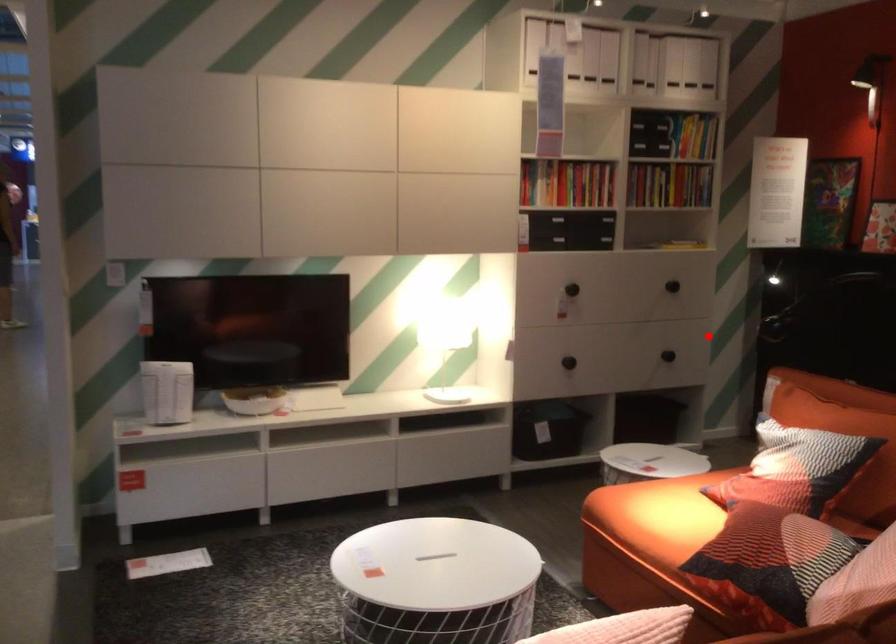
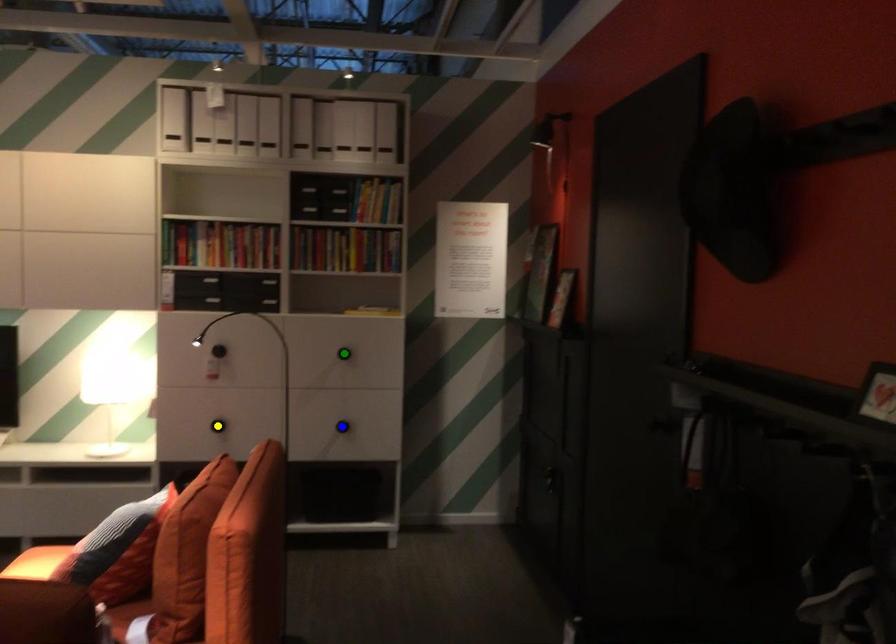
Question: I am providing you with two images of the same scene from different viewpoints. A red point is marked on the first image. You are given multiple points on the second image. Which spot in image 2 lines up with the point in image 1?

Choices:
 (A) yellow point
 (B) blue point
 (C) green point

Answer: (B)